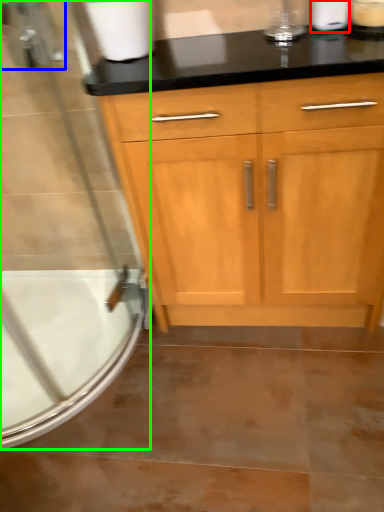
Question: Which object is the farthest from toilet paper (highlighted by a red box)? Choose among these: faucet (highlighted by a blue box) or screen door (highlighted by a green box).

Choices:
 (A) faucet
 (B) screen door

Answer: (B)